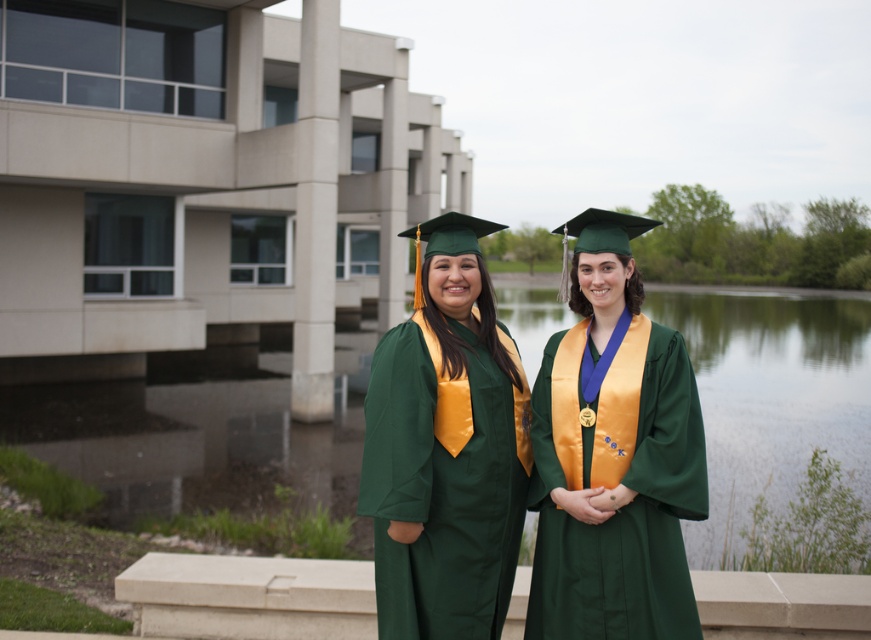
Question: Can you confirm if green satin graduation gown at center is thinner than green matte graduation gown at center?

Choices:
 (A) no
 (B) yes

Answer: (B)

Question: Can you confirm if green satin graduation gown at center is thinner than green matte graduation gown at center?

Choices:
 (A) no
 (B) yes

Answer: (B)

Question: Is green satin graduation gown at center positioned in front of green matte graduation gown at center?

Choices:
 (A) yes
 (B) no

Answer: (A)